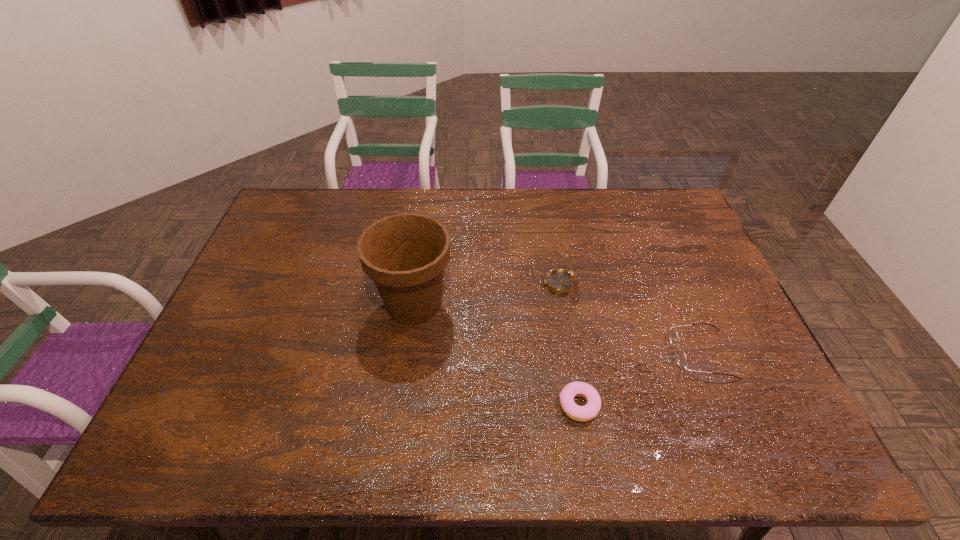
In the image, there is a desktop. Where is `vacant space at the far right corner`? This screenshot has height=540, width=960. vacant space at the far right corner is located at coordinates (666, 222).

Where is `vacant area that lies between the doughnut and the compass`? vacant area that lies between the doughnut and the compass is located at coordinates (568, 345).

Identify the location of vacant space that's between the shortest object and the second tallest object. (568, 345).

This screenshot has width=960, height=540. What are the coordinates of `free space between the spectacles and the nearest object` in the screenshot? It's located at (640, 380).

Where is `free space that is in between the rightmost object and the flowerpot`? This screenshot has width=960, height=540. free space that is in between the rightmost object and the flowerpot is located at coordinates (558, 329).

Where is `vacant point located between the third tallest object and the second tallest object`? vacant point located between the third tallest object and the second tallest object is located at coordinates (630, 319).

Locate an element on the screen. The image size is (960, 540). free space between the second tallest object and the flowerpot is located at coordinates (486, 294).

This screenshot has height=540, width=960. Find the location of `free spot between the compass and the tallest object`. free spot between the compass and the tallest object is located at coordinates (486, 294).

At what (x,y) coordinates should I click in order to perform the action: click on vacant area that lies between the doughnut and the tallest object. Please return your answer as a coordinate pair (x, y). This screenshot has height=540, width=960. Looking at the image, I should click on (496, 354).

You are a GUI agent. You are given a task and a screenshot of the screen. Output one action in this format:
    pyautogui.click(x=<x>, y=<y>)
    Task: Click on the unoccupied area between the tallest object and the second shortest object
    This screenshot has width=960, height=540.
    Given the screenshot: What is the action you would take?
    pyautogui.click(x=558, y=329)